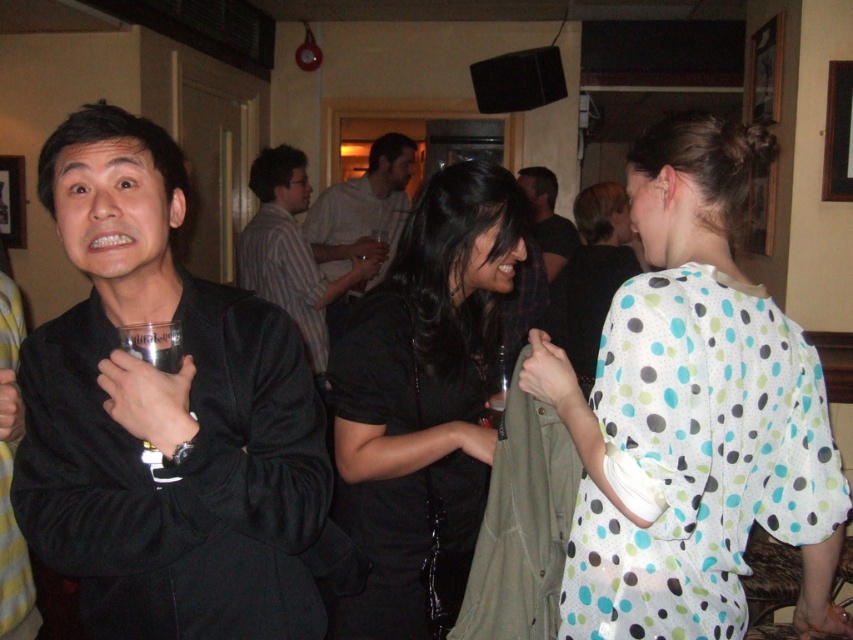
Who is positioned more to the right, striped cotton shirt at center or white dotted dress at center?

white dotted dress at center is more to the right.

Which of these two, striped cotton shirt at center or white dotted dress at center, stands taller?

Standing taller between the two is striped cotton shirt at center.

Describe the element at coordinates (289, 250) in the screenshot. I see `striped cotton shirt at center` at that location.

Where is `striped cotton shirt at center`? This screenshot has height=640, width=853. striped cotton shirt at center is located at coordinates (289, 250).

Between white polka dot blouse at center and striped cotton shirt at center, which one has more height?

Standing taller between the two is striped cotton shirt at center.

Who is more forward, (636, 307) or (251, 240)?

Positioned in front is point (636, 307).

Locate an element on the screen. The height and width of the screenshot is (640, 853). white polka dot blouse at center is located at coordinates (694, 413).

How much distance is there between striped cotton shirt at center and light brown shirt at center?

They are 17.56 inches apart.

Which is above, striped cotton shirt at center or light brown shirt at center?

light brown shirt at center is above.

At what (x,y) coordinates should I click in order to perform the action: click on striped cotton shirt at center. Please return your answer as a coordinate pair (x, y). Looking at the image, I should click on 289,250.